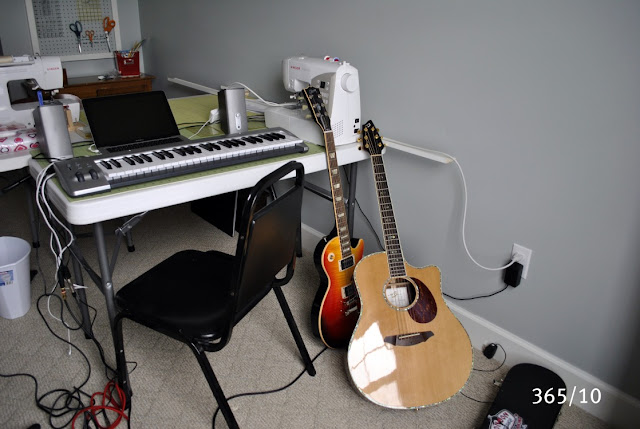
Identify the location of plug. (513, 275), (515, 259), (486, 352), (70, 277), (64, 291).